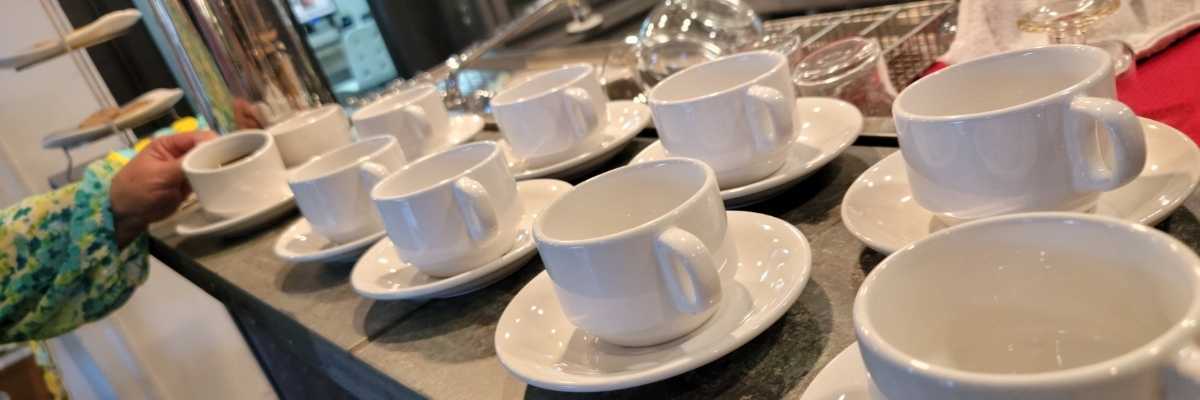
Locate an element on the screen. cups is located at coordinates (626, 233), (450, 209), (338, 170), (253, 168), (290, 131), (396, 117), (570, 110), (756, 107), (997, 118), (984, 310).